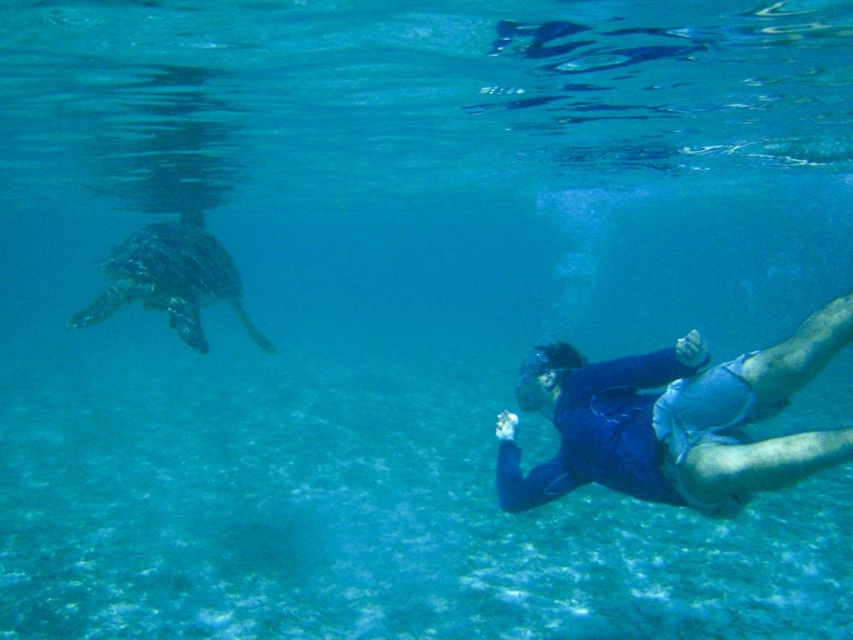
Does blue fabric diver at lower right have a lesser height compared to green textured turtle at left?

Yes, blue fabric diver at lower right is shorter than green textured turtle at left.

The height and width of the screenshot is (640, 853). Describe the element at coordinates (675, 420) in the screenshot. I see `blue fabric diver at lower right` at that location.

At what (x,y) coordinates should I click in order to perform the action: click on blue fabric diver at lower right. Please return your answer as a coordinate pair (x, y). This screenshot has width=853, height=640. Looking at the image, I should click on (675, 420).